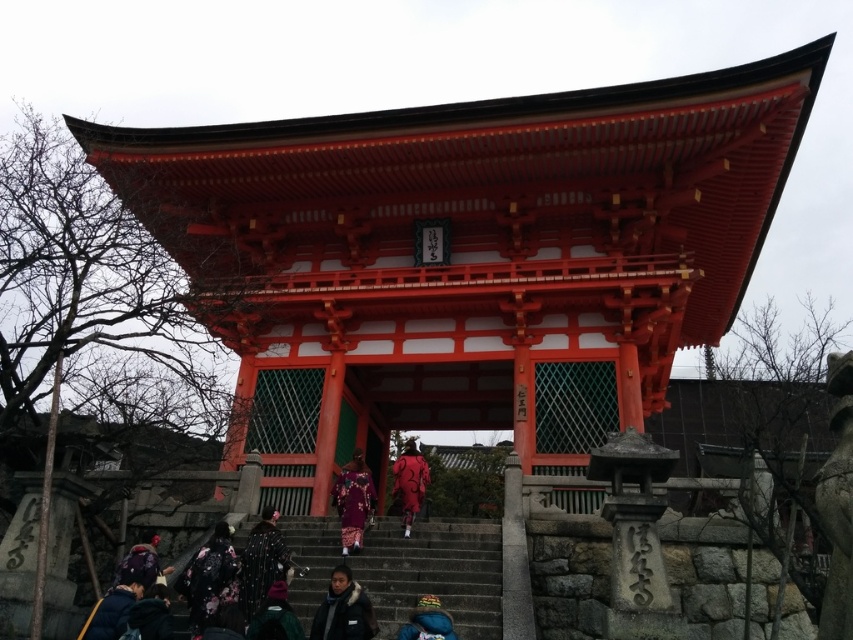
You are a GUI agent. You are given a task and a screenshot of the screen. Output one action in this format:
    pyautogui.click(x=<x>, y=<y>)
    Task: Click on the floral kimono at lower left
    Image resolution: width=853 pixels, height=640 pixels.
    Given the screenshot: What is the action you would take?
    pyautogui.click(x=209, y=579)

Is floral kimono at lower left wider than velvet purple kimono at lower left?

No, floral kimono at lower left is not wider than velvet purple kimono at lower left.

Which is behind, point (201, 621) or point (141, 548)?

Point (141, 548)

The height and width of the screenshot is (640, 853). What are the coordinates of `floral kimono at lower left` in the screenshot? It's located at (209, 579).

Can you confirm if floral kimono at lower left is positioned above silky purple kimono at center?

No.

Is floral kimono at lower left below silky purple kimono at center?

Yes.

Measure the distance between floral kimono at lower left and camera.

floral kimono at lower left and camera are 37.44 feet apart.

Locate an element on the screen. Image resolution: width=853 pixels, height=640 pixels. floral kimono at lower left is located at coordinates (209, 579).

Looking at this image, measure the distance between shiny red wood gate at center and camera.

shiny red wood gate at center and camera are 16.71 meters apart.

Locate an element on the screen. The image size is (853, 640). shiny red wood gate at center is located at coordinates (469, 256).